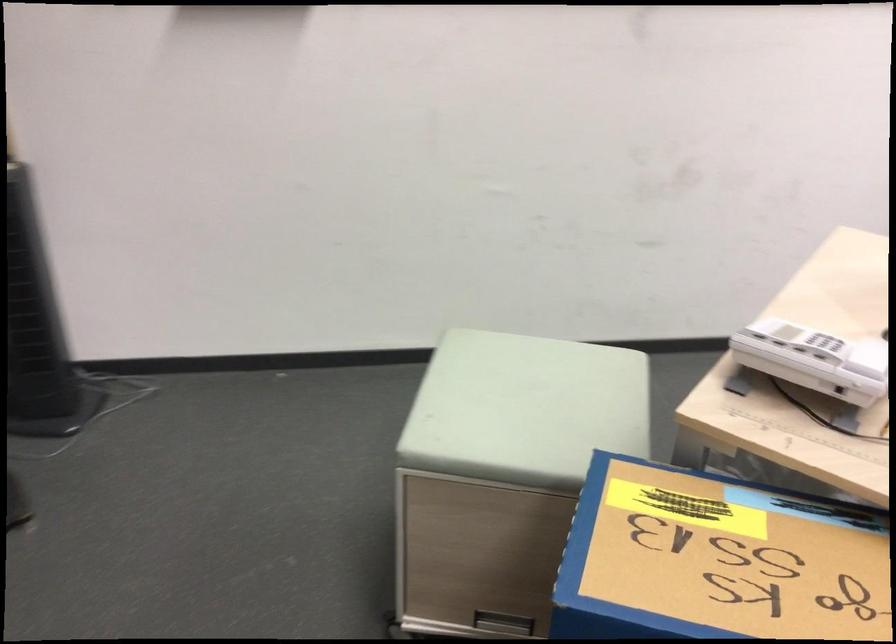
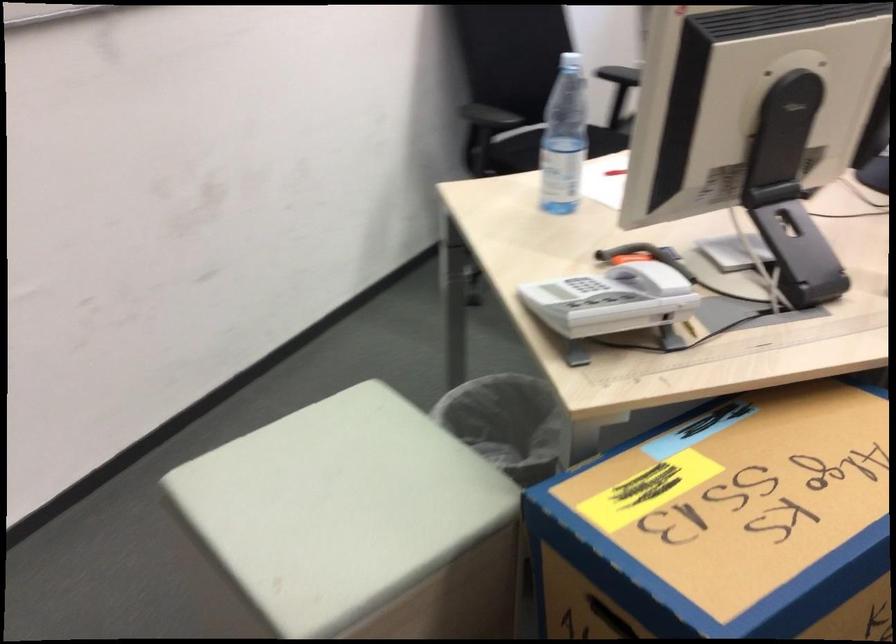
Where in the second image is the point corresponding to pixel 576 576 from the first image?

(600, 617)